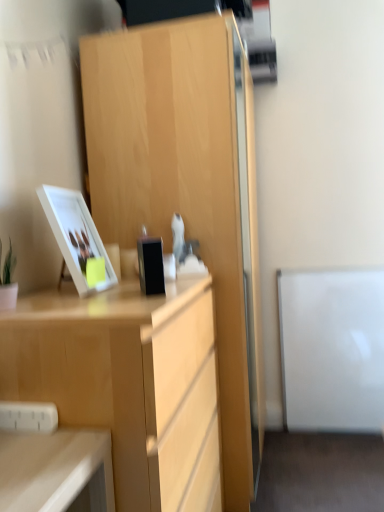
Question: Is white glossy picture frame at upper left in front of or behind black glossy phone at center in the image?

Choices:
 (A) front
 (B) behind

Answer: (B)

Question: Is white glossy picture frame at upper left taller or shorter than black glossy phone at center?

Choices:
 (A) short
 (B) tall

Answer: (B)

Question: Based on their relative distances, which object is nearer to the black glossy phone at center?

Choices:
 (A) light wood cabinet at center
 (B) white glossy picture frame at upper left
 (C) light wood desk at center

Answer: (B)

Question: Estimate the real-world distances between objects in this image. Which object is farther from the black glossy phone at center?

Choices:
 (A) light wood desk at center
 (B) light wood cabinet at center
 (C) white glossy picture frame at upper left

Answer: (B)